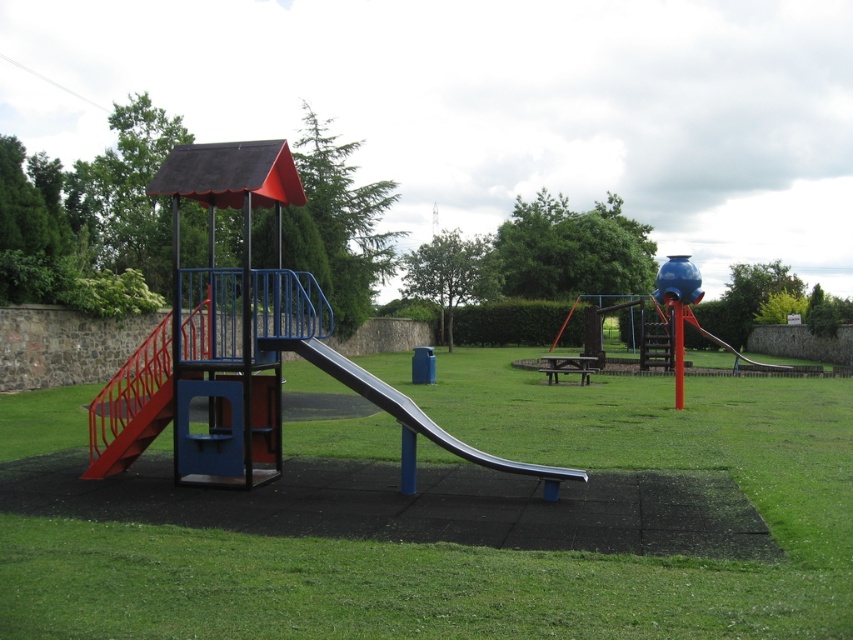
Question: Is green grass at center to the left of metallic blue slide at center from the viewer's perspective?

Choices:
 (A) no
 (B) yes

Answer: (B)

Question: Which point is farther to the camera?

Choices:
 (A) (817, 612)
 (B) (329, 349)

Answer: (B)

Question: Which object is closer to the camera taking this photo?

Choices:
 (A) metallic blue slide at center
 (B) green grass at center

Answer: (B)

Question: Can you confirm if green grass at center is smaller than metallic blue slide at center?

Choices:
 (A) no
 (B) yes

Answer: (A)

Question: Where is green grass at center located in relation to metallic blue slide at center in the image?

Choices:
 (A) below
 (B) above

Answer: (A)